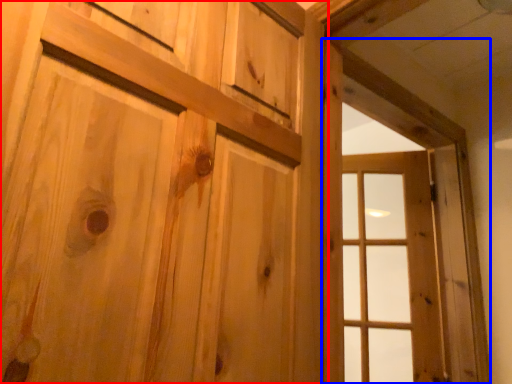
Question: Which object is further to the camera taking this photo, door (highlighted by a red box) or window frame (highlighted by a blue box)?

Choices:
 (A) door
 (B) window frame

Answer: (B)